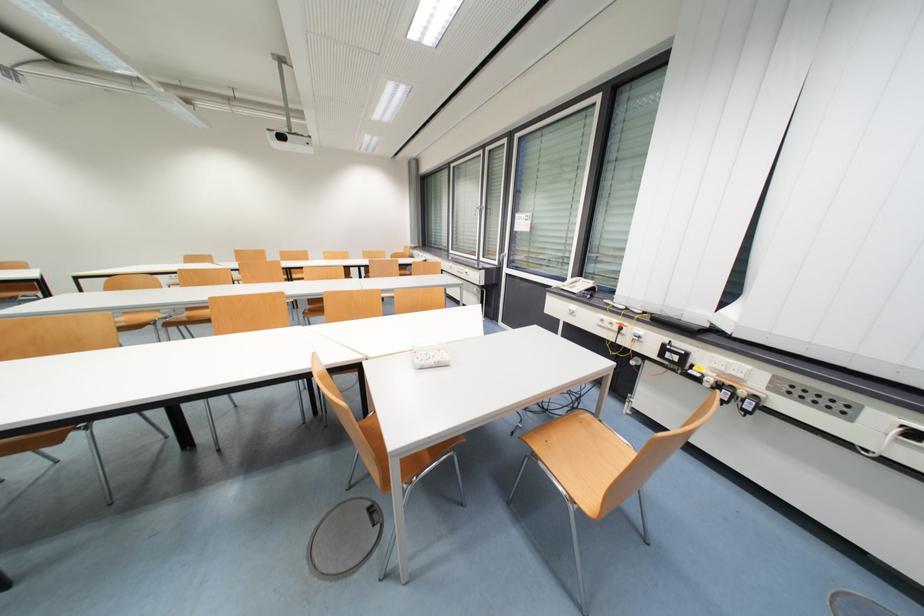
Locate an element on the screen. white telephone handset is located at coordinates (577, 285).